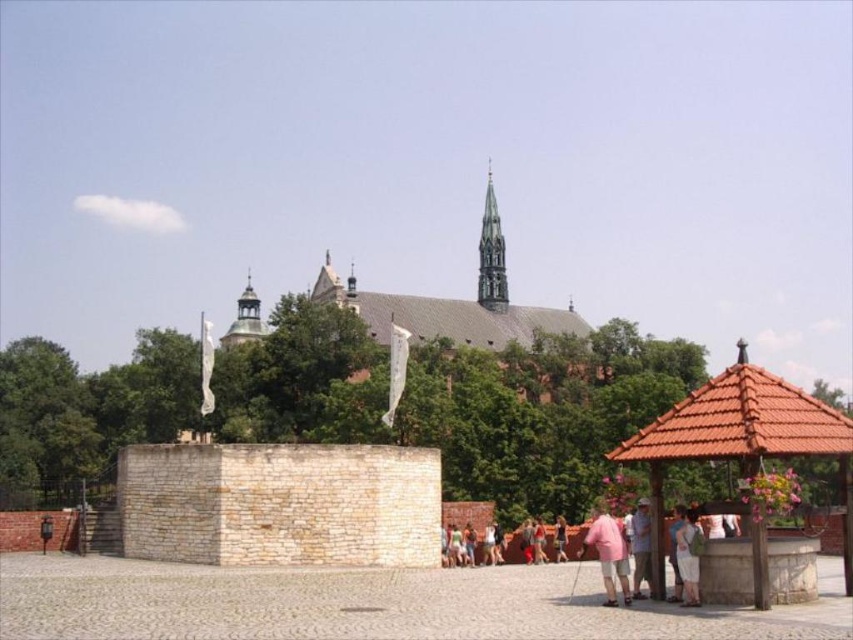
You are standing at the entrance of the historic church and see the brown tiled gazebo at lower right and the pink cotton shirt at lower center. Which object is higher in the image?

The brown tiled gazebo at lower right is above the pink cotton shirt at lower center, so the gazebo is higher in the image.

From the picture: You are standing in front of the historic church and want to take a photo that includes both the gray stone spire at center and the gold textured dome at center. Which object should you position closer to the camera to ensure both are in focus?

You should position the gray stone spire at center closer to the camera since it is already closer to you than the gold textured dome at center. This will help ensure both are in focus by maintaining a consistent focal distance.